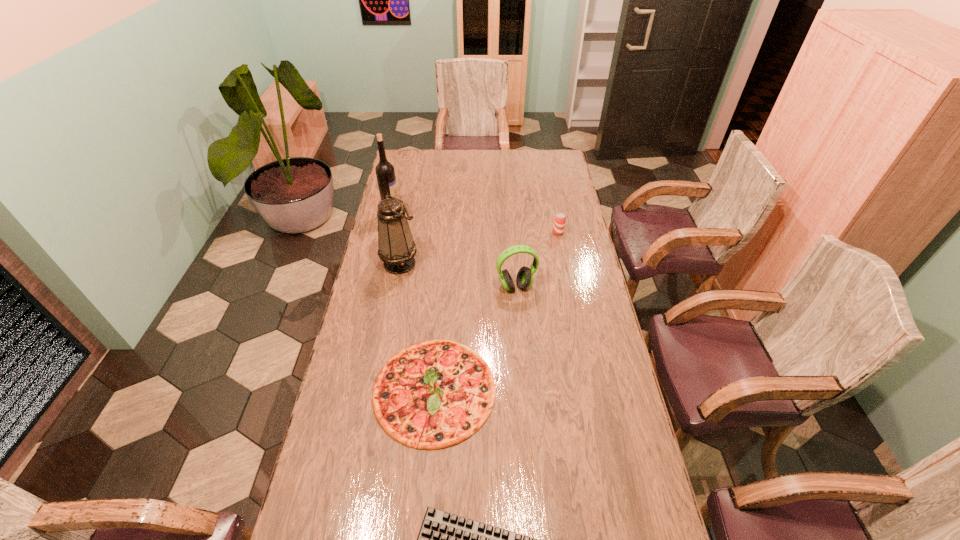
You are a GUI agent. You are given a task and a screenshot of the screen. Output one action in this format:
    pyautogui.click(x=<x>, y=<y>)
    Task: Click on the free space that satisfies the following two spatial constraints: 1. on the front side of the second tallest object; 2. on the right side of the fifth farthest object
    This screenshot has height=540, width=960.
    Given the screenshot: What is the action you would take?
    pyautogui.click(x=376, y=390)

Image resolution: width=960 pixels, height=540 pixels. Identify the location of vacant region that satisfies the following two spatial constraints: 1. on the back side of the rightmost object; 2. on the label of the tallest object. (555, 216).

Identify the location of free spot that satisfies the following two spatial constraints: 1. on the label of the farthest object; 2. on the left side of the oil lamp. The image size is (960, 540). (382, 264).

The height and width of the screenshot is (540, 960). I want to click on vacant space that satisfies the following two spatial constraints: 1. on the label of the farthest object; 2. on the back side of the second tallest object, so click(382, 264).